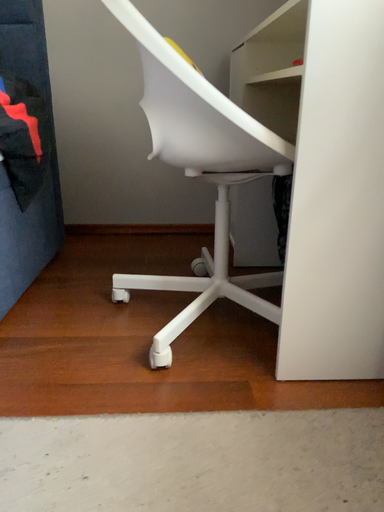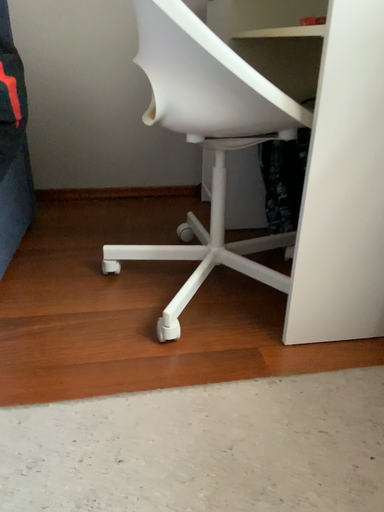
Question: Which way did the camera rotate in the video?

Choices:
 (A) rotated right
 (B) rotated left

Answer: (A)